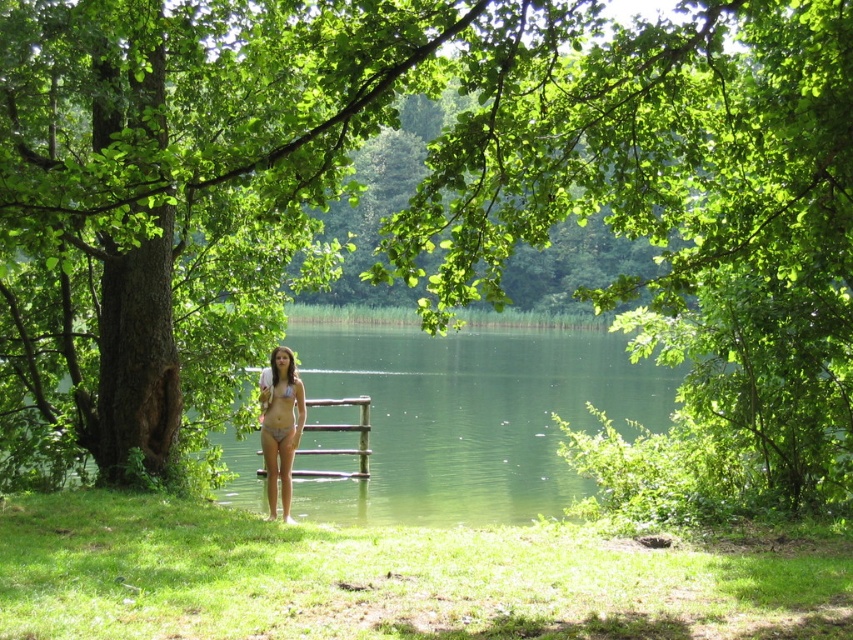
Question: Is white matte bikini at center to the left of matte white bikini top at center from the viewer's perspective?

Choices:
 (A) no
 (B) yes

Answer: (B)

Question: Is matte white bikini at center below matte white bikini top at center?

Choices:
 (A) yes
 (B) no

Answer: (A)

Question: Which point is closer to the camera?

Choices:
 (A) (292, 388)
 (B) (274, 486)

Answer: (B)

Question: Among these points, which one is nearest to the camera?

Choices:
 (A) (289, 374)
 (B) (281, 394)

Answer: (B)

Question: Which of the following is the farthest from the observer?

Choices:
 (A) white matte bikini at center
 (B) matte white bikini top at center

Answer: (B)

Question: Can you confirm if white matte bikini at center is positioned to the right of matte white bikini top at center?

Choices:
 (A) yes
 (B) no

Answer: (B)